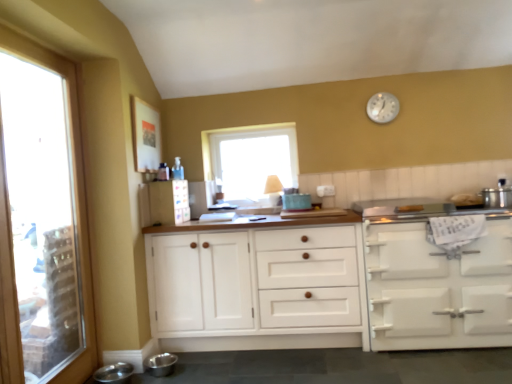
Measure the distance between point (366, 309) and camera.

Point (366, 309) and camera are 2.78 meters apart.

Locate an element on the screen. Image resolution: width=512 pixels, height=384 pixels. white matte oven at right, which ranks as the 1th cabinetry in right-to-left order is located at coordinates (438, 288).

This screenshot has width=512, height=384. I want to click on clear glass window at left, which ranks as the second window in back-to-front order, so click(42, 221).

What do you see at coordinates (114, 373) in the screenshot?
I see `stainless steel bowls at lower left, positioned as the 3th appliance in top-to-bottom order` at bounding box center [114, 373].

Find the location of a particular element. The height and width of the screenshot is (384, 512). stainless steel bowls at lower left, the 1th appliance from the bottom is located at coordinates pyautogui.click(x=114, y=373).

In order to face stainless steel pot at right, the first appliance when ordered from right to left, should I rotate leftwards or rightwards?

Rotate your view right by about 30.027°.

Locate an element on the screen. Image resolution: width=512 pixels, height=384 pixels. white wood cabinet at center, marked as the 2th cabinetry in a right-to-left arrangement is located at coordinates (257, 287).

Is point (42, 364) behind point (292, 308)?

No, it is not.

Is white wood cabinet at center, marked as the 2th cabinetry in a right-to-left arrangement, at the back of clear glass window at left, which ranks as the second window in back-to-front order?

No, clear glass window at left, which ranks as the second window in back-to-front order,'s orientation is not away from white wood cabinet at center, marked as the 2th cabinetry in a right-to-left arrangement.

Considering the positions of objects clear glass window at left, which ranks as the 1th window in left-to-right order, and white wood cabinet at center, the 1th cabinetry when ordered from left to right, in the image provided, who is more to the right, clear glass window at left, which ranks as the 1th window in left-to-right order, or white wood cabinet at center, the 1th cabinetry when ordered from left to right,?

From the viewer's perspective, white wood cabinet at center, the 1th cabinetry when ordered from left to right, appears more on the right side.

From a real-world perspective, who is located lower, clear glass window at left, which ranks as the 1th window in left-to-right order, or white wood cabinet at center, marked as the 2th cabinetry in a right-to-left arrangement?

From a 3D spatial view, white wood cabinet at center, marked as the 2th cabinetry in a right-to-left arrangement, is below.

From the image's perspective, which cabinetry is the 2nd one below the stainless steel pot at right, which ranks as the 2th appliance in front-to-back order? Please provide its 2D coordinates.

[(257, 287)]

Between stainless steel pot at right, the 2th appliance in the back-to-front sequence, and white wood cabinet at center, the 1th cabinetry when ordered from left to right, which one has more height?

With more height is white wood cabinet at center, the 1th cabinetry when ordered from left to right.

Is stainless steel pot at right, the first appliance when ordered from right to left, directly adjacent to white wood cabinet at center, marked as the 2th cabinetry in a right-to-left arrangement?

No, stainless steel pot at right, the first appliance when ordered from right to left, is not beside white wood cabinet at center, marked as the 2th cabinetry in a right-to-left arrangement.

Which cabinetry is the 1st one when counting from the front of the wooden spice rack at center, the second appliance ordered from the bottom? Please provide its 2D coordinates.

[(257, 287)]

Does white wood cabinet at center, marked as the 2th cabinetry in a right-to-left arrangement, have a greater height compared to wooden spice rack at center, the 3th appliance when ordered from front to back?

Indeed, white wood cabinet at center, marked as the 2th cabinetry in a right-to-left arrangement, has a greater height compared to wooden spice rack at center, the 3th appliance when ordered from front to back.

Is white wood cabinet at center, the 1th cabinetry when ordered from left to right, at the right side of wooden spice rack at center, the second appliance ordered from the bottom?

Yes.

Is white wood cabinet at center, marked as the 2th cabinetry in a right-to-left arrangement, positioned with its back to wooden spice rack at center, which ranks as the 2th appliance in right-to-left order?

No, white wood cabinet at center, marked as the 2th cabinetry in a right-to-left arrangement, is not facing the opposite direction of wooden spice rack at center, which ranks as the 2th appliance in right-to-left order.

Is silver metallic clock at upper center spatially inside wooden spice rack at center, which ranks as the 2th appliance in right-to-left order, or outside of it?

silver metallic clock at upper center cannot be found inside wooden spice rack at center, which ranks as the 2th appliance in right-to-left order.

Who is shorter, silver metallic clock at upper center or wooden spice rack at center, arranged as the second appliance when viewed from the left?

Standing shorter between the two is silver metallic clock at upper center.

Which object is further away from the camera taking this photo, silver metallic clock at upper center or wooden spice rack at center, arranged as the second appliance when viewed from the left?

silver metallic clock at upper center is more distant.

Considering the relative sizes of silver metallic clock at upper center and wooden spice rack at center, arranged as the 2th appliance when viewed from the top, in the image provided, is silver metallic clock at upper center bigger than wooden spice rack at center, arranged as the 2th appliance when viewed from the top,?

No.

Does wooden spice rack at center, the second appliance ordered from the bottom, lie behind transparent glass window at center, the 2th window in the front-to-back sequence?

No, the depth of wooden spice rack at center, the second appliance ordered from the bottom, is less than that of transparent glass window at center, the 2th window in the front-to-back sequence.

Does wooden spice rack at center, placed as the 1th appliance when sorted from back to front, have a lesser width compared to transparent glass window at center, positioned as the 1th window in right-to-left order?

Incorrect, the width of wooden spice rack at center, placed as the 1th appliance when sorted from back to front, is not less than that of transparent glass window at center, positioned as the 1th window in right-to-left order.

Can you confirm if wooden spice rack at center, the second appliance ordered from the bottom, is positioned to the left of transparent glass window at center, which is the second window in left-to-right order?

Yes.

Considering the relative sizes of wooden spice rack at center, which ranks as the 2th appliance in right-to-left order, and transparent glass window at center, which is the second window in left-to-right order, in the image provided, is wooden spice rack at center, which ranks as the 2th appliance in right-to-left order, shorter than transparent glass window at center, which is the second window in left-to-right order,?

Correct, wooden spice rack at center, which ranks as the 2th appliance in right-to-left order, is not as tall as transparent glass window at center, which is the second window in left-to-right order.

In the scene shown: Which of these two, wooden spice rack at center, placed as the 1th appliance when sorted from back to front, or stainless steel bowls at lower left, positioned as the first appliance in front-to-back order, stands shorter?

Standing shorter between the two is stainless steel bowls at lower left, positioned as the first appliance in front-to-back order.

Is stainless steel bowls at lower left, acting as the first appliance starting from the left, surrounded by wooden spice rack at center, arranged as the second appliance when viewed from the left?

That's incorrect, stainless steel bowls at lower left, acting as the first appliance starting from the left, is not inside wooden spice rack at center, arranged as the second appliance when viewed from the left.

In the scene shown: Can you tell me how much wooden spice rack at center, the 3th appliance when ordered from front to back, and stainless steel bowls at lower left, positioned as the 3th appliance in top-to-bottom order, differ in facing direction?

The angular difference between wooden spice rack at center, the 3th appliance when ordered from front to back, and stainless steel bowls at lower left, positioned as the 3th appliance in top-to-bottom order, is 4.75 degrees.

Which is behind, point (391, 287) or point (497, 191)?

The point (497, 191) is farther from the camera.

Is white matte oven at right, the second cabinetry positioned from the left, positioned behind stainless steel pot at right, which is counted as the 3th appliance, starting from the bottom?

No, white matte oven at right, the second cabinetry positioned from the left, is closer to the camera.

From the image's perspective, is white matte oven at right, which ranks as the 1th cabinetry in right-to-left order, above or below stainless steel pot at right, the 2th appliance in the back-to-front sequence?

Based on their image positions, white matte oven at right, which ranks as the 1th cabinetry in right-to-left order, is located beneath stainless steel pot at right, the 2th appliance in the back-to-front sequence.

Locate an element on the screen. window that is the 1st one above the white wood cabinet at center, the 1th cabinetry when ordered from left to right (from a real-world perspective) is located at coordinates (42, 221).

At what (x,y) coordinates should I click in order to perform the action: click on the 1st cabinetry positioned below the stainless steel pot at right, which ranks as the 2th appliance in front-to-back order (from a real-world perspective). Please return your answer as a coordinate pair (x, y). Looking at the image, I should click on (257, 287).

Considering their positions, is transparent glass window at center, positioned as the 1th window in right-to-left order, positioned further to white wood cabinet at center, the 1th cabinetry when ordered from left to right, than white matte oven at right, which ranks as the 1th cabinetry in right-to-left order?

transparent glass window at center, positioned as the 1th window in right-to-left order, is positioned further to the anchor white wood cabinet at center, the 1th cabinetry when ordered from left to right.

Looking at the image, which one is located closer to stainless steel pot at right, which ranks as the 2th appliance in front-to-back order, white wood cabinet at center, marked as the 2th cabinetry in a right-to-left arrangement, or wooden spice rack at center, which ranks as the 2th appliance in right-to-left order?

Among the two, white wood cabinet at center, marked as the 2th cabinetry in a right-to-left arrangement, is located nearer to stainless steel pot at right, which ranks as the 2th appliance in front-to-back order.

Based on their spatial positions, is clear glass window at left, which ranks as the second window in back-to-front order, or stainless steel bowls at lower left, acting as the first appliance starting from the left, further from wooden spice rack at center, placed as the 1th appliance when sorted from back to front?

Among the two, stainless steel bowls at lower left, acting as the first appliance starting from the left, is located further to wooden spice rack at center, placed as the 1th appliance when sorted from back to front.

Looking at the image, which one is located closer to white wood cabinet at center, the 1th cabinetry when ordered from left to right, stainless steel bowls at lower left, acting as the first appliance starting from the left, or transparent glass window at center, positioned as the 1th window in right-to-left order?

Among the two, stainless steel bowls at lower left, acting as the first appliance starting from the left, is located nearer to white wood cabinet at center, the 1th cabinetry when ordered from left to right.

Looking at the image, which one is located closer to transparent glass window at center, which is the second window in left-to-right order, silver metallic clock at upper center or stainless steel bowls at lower left, acting as the first appliance starting from the left?

The object closer to transparent glass window at center, which is the second window in left-to-right order, is silver metallic clock at upper center.

Consider the image. Looking at the image, which one is located further to white matte oven at right, which ranks as the 1th cabinetry in right-to-left order, silver metallic clock at upper center or stainless steel bowls at lower left, which is the 3th appliance from back to front?

stainless steel bowls at lower left, which is the 3th appliance from back to front, is positioned further to the anchor white matte oven at right, which ranks as the 1th cabinetry in right-to-left order.

Looking at the image, which one is located closer to white wood cabinet at center, the 1th cabinetry when ordered from left to right, stainless steel bowls at lower left, which is the 3th appliance from back to front, or wooden spice rack at center, the second appliance ordered from the bottom?

Among the two, wooden spice rack at center, the second appliance ordered from the bottom, is located nearer to white wood cabinet at center, the 1th cabinetry when ordered from left to right.

Which object lies nearer to the anchor point clear glass window at left, which is the second window from right to left, silver metallic clock at upper center or wooden spice rack at center, placed as the 1th appliance when sorted from back to front?

wooden spice rack at center, placed as the 1th appliance when sorted from back to front, lies closer to clear glass window at left, which is the second window from right to left, than the other object.

Where is `window between wooden spice rack at center, the second appliance ordered from the bottom, and silver metallic clock at upper center`? window between wooden spice rack at center, the second appliance ordered from the bottom, and silver metallic clock at upper center is located at coordinates (250, 158).

This screenshot has width=512, height=384. I want to click on clock situated between transparent glass window at center, the 2th window in the front-to-back sequence, and white matte oven at right, which ranks as the 1th cabinetry in right-to-left order, from left to right, so click(382, 107).

Where is `cabinetry situated between transparent glass window at center, the first window positioned from the back, and white matte oven at right, the second cabinetry positioned from the left, from left to right`? The image size is (512, 384). cabinetry situated between transparent glass window at center, the first window positioned from the back, and white matte oven at right, the second cabinetry positioned from the left, from left to right is located at coordinates (257, 287).

In order to click on cabinetry between clear glass window at left, which is the second window from right to left, and silver metallic clock at upper center from left to right in this screenshot , I will do `click(257, 287)`.